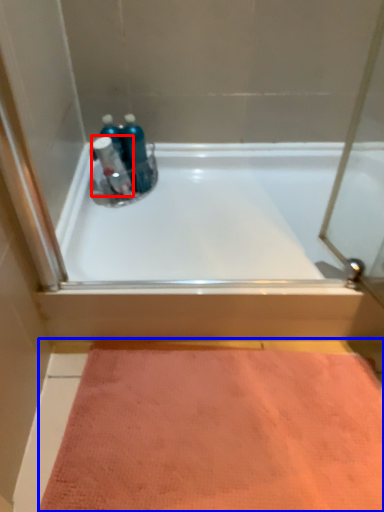
Question: Which of the following is the closest to the observer, cleaning product (highlighted by a red box) or doormat (highlighted by a blue box)?

Choices:
 (A) cleaning product
 (B) doormat

Answer: (B)